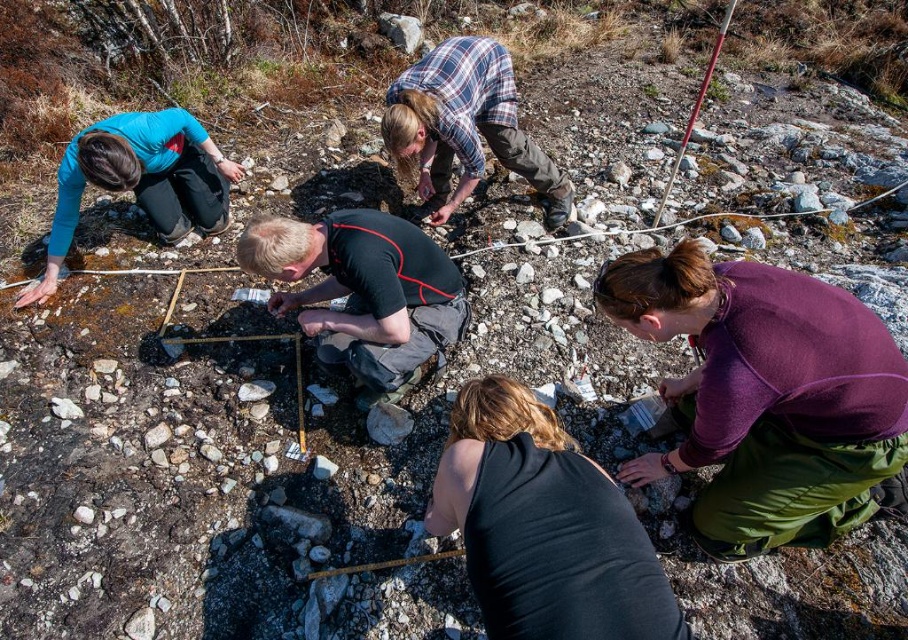
Based on the photo, you are a field assistant observing the archaeological survey team. You notice two team members wearing the black matte tank top at lower center and the matte blue shirt at upper left. Which member is closer to you, the observer?

The black matte tank top at lower center is closer to you because it is in front of the matte blue shirt at upper left in the image.

You are a field assistant who needs to hand a tool to both the person wearing the black matte tank top at lower center and the person in the plaid flannel shirt at upper center. Since you are standing at the center of the image, which direction should you move to reach each of them first?

The black matte tank top at lower center is in front of the plaid flannel shirt at upper center, so you should move forward to reach the black matte tank top at lower center first and then move backward to reach the plaid flannel shirt at upper center.